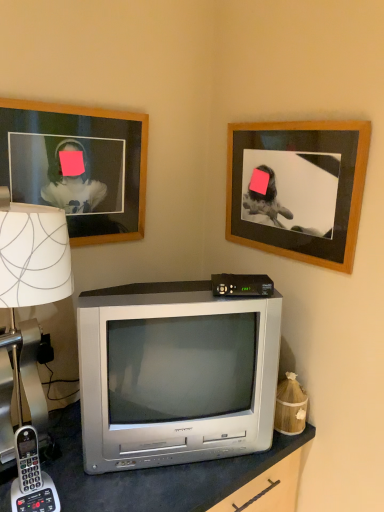
Question: Visually, is wooden frame at upper right, placed as the second picture frame when sorted from left to right, positioned to the left or to the right of white paper lampshade at left?

Choices:
 (A) left
 (B) right

Answer: (B)

Question: Relative to white paper lampshade at left, is wooden frame at upper right, the 1th picture frame positioned from the right, in front or behind?

Choices:
 (A) front
 (B) behind

Answer: (B)

Question: Based on their relative distances, which object is nearer to the wooden framed photo at upper left, which is the second picture frame in right-to-left order?

Choices:
 (A) white paper lampshade at left
 (B) gray plastic phone at lower left
 (C) silver metallic television at center
 (D) black plastic/cable box at center
 (E) wooden frame at upper right, the 1th picture frame positioned from the right

Answer: (A)

Question: Considering the real-world distances, which object is closest to the wooden frame at upper right, the 1th picture frame positioned from the right?

Choices:
 (A) silver metallic television at center
 (B) black plastic/cable box at center
 (C) white paper lampshade at left
 (D) wooden framed photo at upper left, which is the second picture frame in right-to-left order
 (E) gray plastic phone at lower left

Answer: (B)